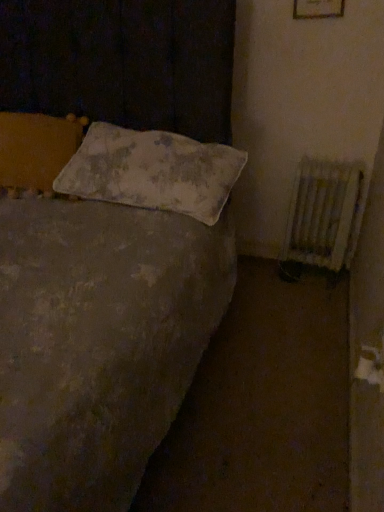
Question: From the image's perspective, is white painted metal radiator at right beneath white fabric pillow at center?

Choices:
 (A) yes
 (B) no

Answer: (A)

Question: Can you confirm if white painted metal radiator at right is positioned to the left of white fabric pillow at center?

Choices:
 (A) no
 (B) yes

Answer: (A)

Question: Does white painted metal radiator at right have a greater width compared to white fabric pillow at center?

Choices:
 (A) no
 (B) yes

Answer: (A)

Question: Does white painted metal radiator at right have a lesser width compared to white fabric pillow at center?

Choices:
 (A) no
 (B) yes

Answer: (B)

Question: From a real-world perspective, is white painted metal radiator at right positioned under white fabric pillow at center based on gravity?

Choices:
 (A) no
 (B) yes

Answer: (B)

Question: Are white painted metal radiator at right and white fabric pillow at center far apart?

Choices:
 (A) yes
 (B) no

Answer: (B)

Question: Would you say white fabric pillow at center contains white painted metal radiator at right?

Choices:
 (A) no
 (B) yes

Answer: (A)

Question: From a real-world perspective, is white fabric pillow at center on top of white painted metal radiator at right?

Choices:
 (A) yes
 (B) no

Answer: (A)

Question: Does white fabric pillow at center have a lesser height compared to white painted metal radiator at right?

Choices:
 (A) no
 (B) yes

Answer: (B)

Question: Are white fabric pillow at center and white painted metal radiator at right far apart?

Choices:
 (A) no
 (B) yes

Answer: (A)

Question: From a real-world perspective, is white fabric pillow at center positioned under white painted metal radiator at right based on gravity?

Choices:
 (A) no
 (B) yes

Answer: (A)

Question: Is white fabric pillow at center next to white painted metal radiator at right and touching it?

Choices:
 (A) no
 (B) yes

Answer: (A)

Question: Considering their positions, is white fabric pillow at center located in front of or behind white painted metal radiator at right?

Choices:
 (A) behind
 (B) front

Answer: (B)